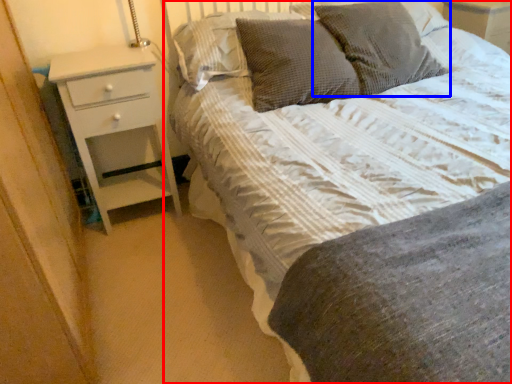
Question: Which object is closer to the camera taking this photo, bed (highlighted by a red box) or pillow (highlighted by a blue box)?

Choices:
 (A) bed
 (B) pillow

Answer: (A)